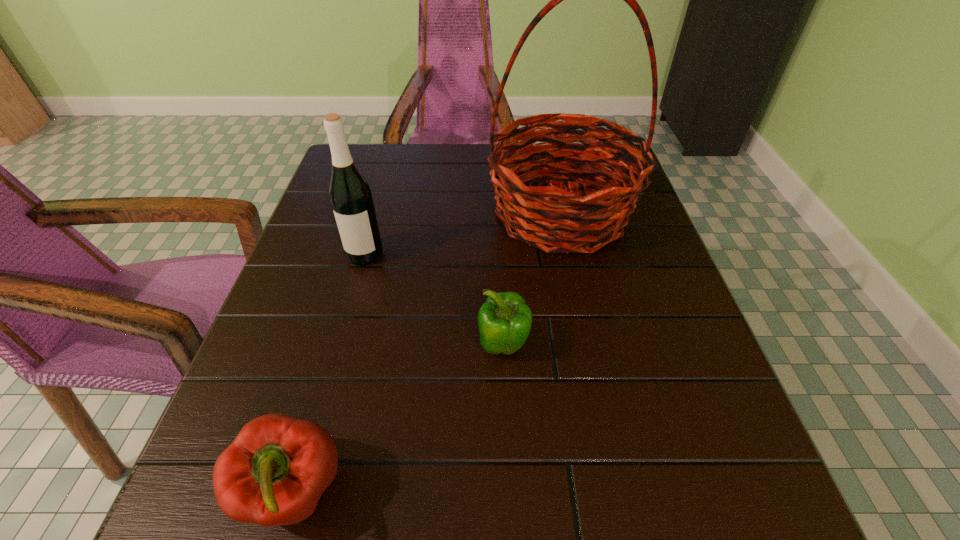
Where is `vacant area that lies between the second tallest object and the tallest object`? This screenshot has height=540, width=960. vacant area that lies between the second tallest object and the tallest object is located at coordinates (463, 234).

What are the coordinates of `vacant point located between the basket and the right bell pepper` in the screenshot? It's located at (532, 280).

This screenshot has height=540, width=960. Identify the location of blank region between the second nearest object and the basket. (532, 280).

At what (x,y) coordinates should I click in order to perform the action: click on free space between the farther bell pepper and the tallest object. Please return your answer as a coordinate pair (x, y). This screenshot has height=540, width=960. Looking at the image, I should click on click(532, 280).

The width and height of the screenshot is (960, 540). What are the coordinates of `empty space between the farther bell pepper and the second tallest object` in the screenshot? It's located at (434, 300).

Find the location of `object that stands as the second closest to the wine bottle`. object that stands as the second closest to the wine bottle is located at coordinates (504, 320).

Point out which object is positioned as the third nearest to the second tallest object. Please provide its 2D coordinates. Your answer should be formatted as a tuple, i.e. [(x, y)], where the tuple contains the x and y coordinates of a point satisfying the conditions above.

[(274, 472)]

Find the location of a particular element. The image size is (960, 540). vacant space that satisfies the following two spatial constraints: 1. on the label of the second tallest object; 2. on the left side of the right bell pepper is located at coordinates (339, 346).